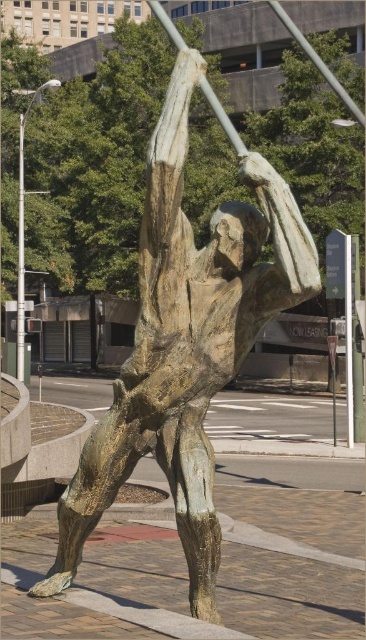
Can you confirm if bronze statue at center is positioned to the left of smooth white pole at upper center?

Correct, you'll find bronze statue at center to the left of smooth white pole at upper center.

Does point (178, 145) come behind point (158, 12)?

No, it is in front of (158, 12).

This screenshot has width=366, height=640. I want to click on bronze statue at center, so click(x=185, y=342).